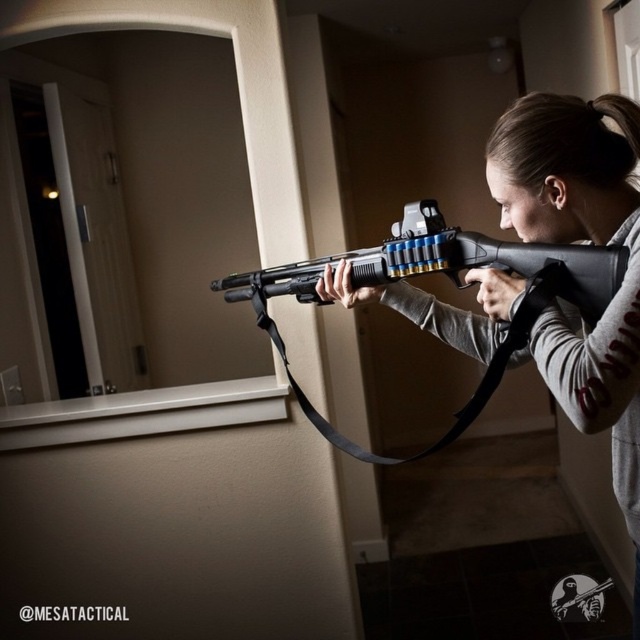
You are a security guard in the room described. You need to quickly identify which shotgun is closer to you. Which one is closer between the matte black shotgun at center and the black matte shotgun at center?

The matte black shotgun at center is closer to you since it is in front of the black matte shotgun at center.

You are standing in the room and see two points marked in the image. Which point is closer to you, point (532, 184) or point (579, 308)?

Point (532, 184) is closer to you than point (579, 308).